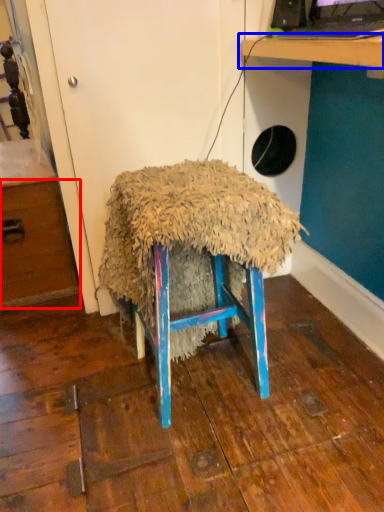
Question: Which object appears closest to the camera in this image, drawer (highlighted by a red box) or table (highlighted by a blue box)?

Choices:
 (A) drawer
 (B) table

Answer: (B)